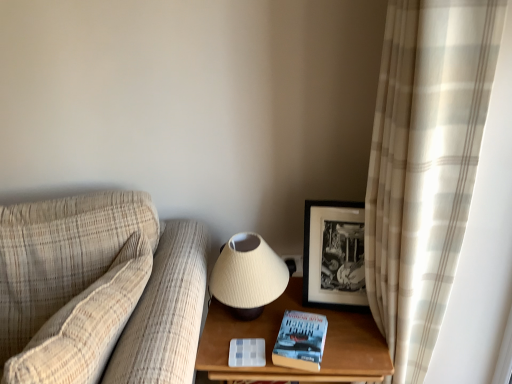
The height and width of the screenshot is (384, 512). Find the location of `vacant space to the right of hardcover blue book at lower right`. vacant space to the right of hardcover blue book at lower right is located at coordinates (355, 339).